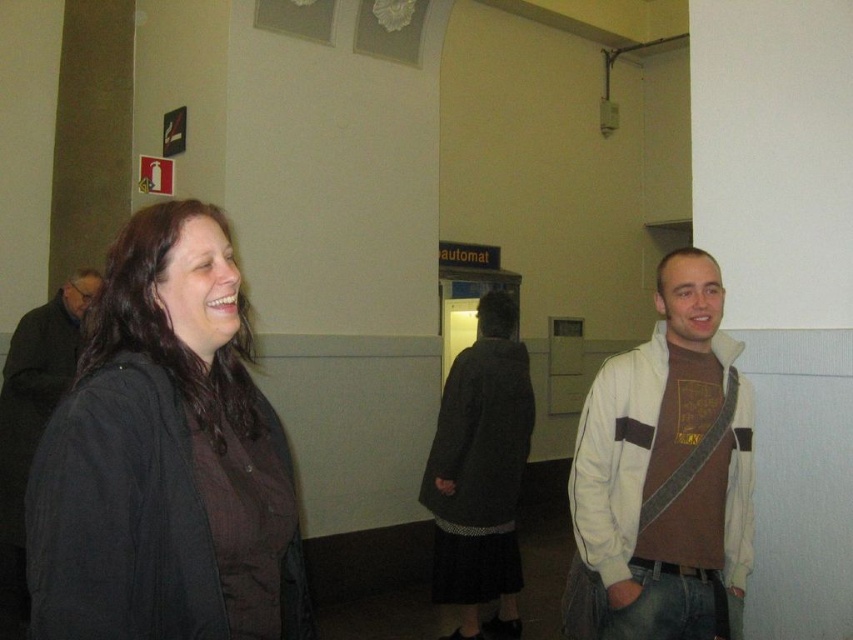
Question: Which object is positioned farthest from the dark gray coat at left?

Choices:
 (A) black matte jacket at left
 (B) white leather jacket at center
 (C) dark gray wool coat at center

Answer: (B)

Question: Is black matte jacket at left wider than white leather jacket at center?

Choices:
 (A) yes
 (B) no

Answer: (B)

Question: Can you confirm if black matte jacket at left is wider than dark gray wool coat at center?

Choices:
 (A) no
 (B) yes

Answer: (A)

Question: Which point appears farthest from the camera in this image?

Choices:
 (A) (247, 422)
 (B) (700, 428)
 (C) (16, 632)

Answer: (C)

Question: Which of the following is the farthest from the observer?

Choices:
 (A) dark gray wool coat at center
 (B) dark gray coat at left
 (C) white leather jacket at center
 (D) black matte jacket at left

Answer: (A)

Question: Can you confirm if white leather jacket at center is smaller than dark gray wool coat at center?

Choices:
 (A) no
 (B) yes

Answer: (B)